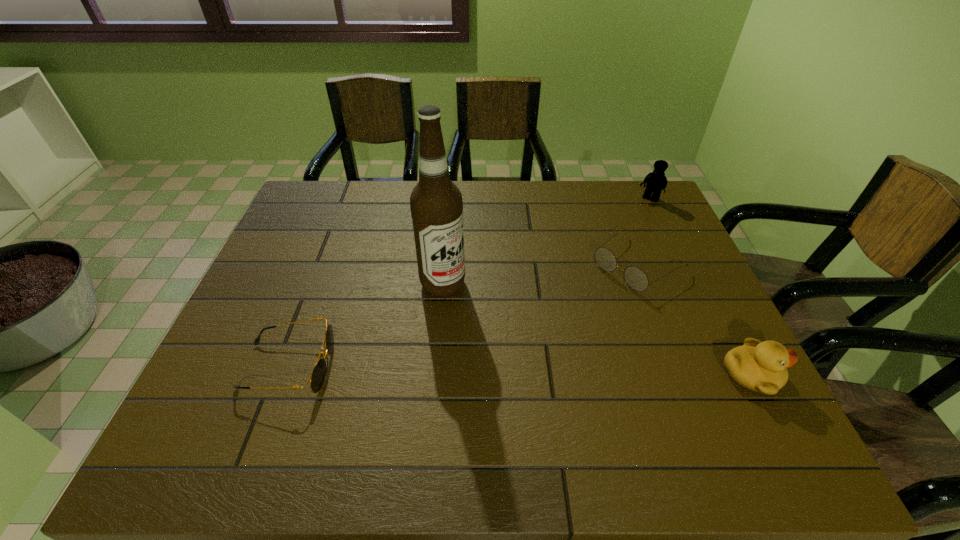
Locate an element on the screen. The height and width of the screenshot is (540, 960). blank space located on the temples of the spectacles is located at coordinates (580, 306).

Image resolution: width=960 pixels, height=540 pixels. What are the coordinates of `free spot located 0.230m on the label of the fourth object from right to left` in the screenshot? It's located at (528, 343).

You are a GUI agent. You are given a task and a screenshot of the screen. Output one action in this format:
    pyautogui.click(x=<x>, y=<y>)
    Task: Click on the free space located 0.220m on the label of the fourth object from right to left
    The image size is (960, 540).
    Given the screenshot: What is the action you would take?
    pyautogui.click(x=524, y=341)

This screenshot has height=540, width=960. Identify the location of vacant space positioned on the label of the fourth object from right to left. (496, 321).

Where is `vacant area situated 0.230m on the front-facing side of the Lego`? The width and height of the screenshot is (960, 540). vacant area situated 0.230m on the front-facing side of the Lego is located at coordinates (621, 243).

The image size is (960, 540). Find the location of `free space located 0.310m on the front-facing side of the Lego`. free space located 0.310m on the front-facing side of the Lego is located at coordinates [612, 258].

I want to click on blank space located 0.270m on the front-facing side of the Lego, so click(616, 251).

In order to click on object present at the far edge in this screenshot , I will do `click(656, 181)`.

In order to click on sunglasses situated at the near edge in this screenshot , I will do `click(317, 377)`.

Find the location of `duckling that is at the near edge`. duckling that is at the near edge is located at coordinates (759, 366).